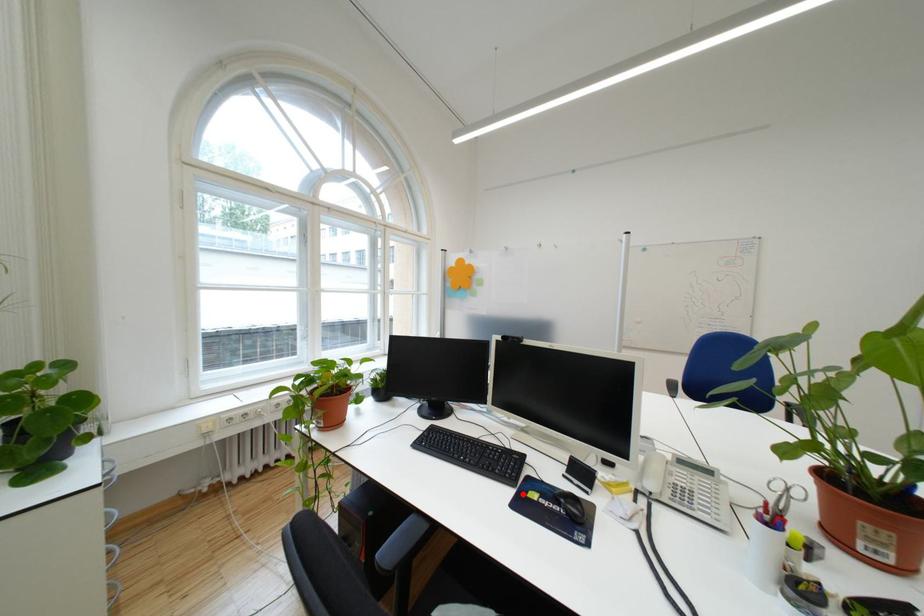
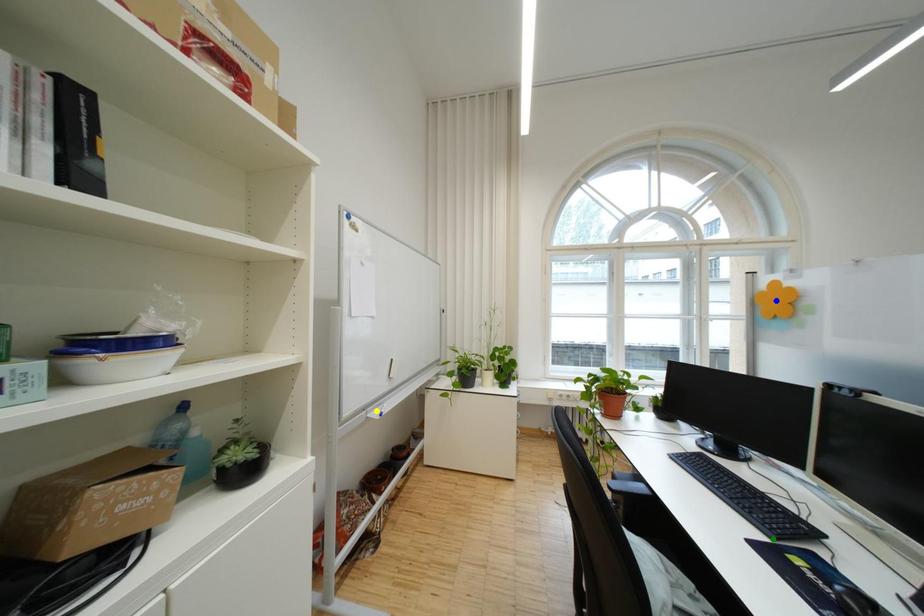
Question: I am providing you with two images of the same scene from different viewpoints. A red point is marked on the first image. You are given multiple points on the second image. Which spot in image 2 lines up with the point in image 1?

Choices:
 (A) green point
 (B) yellow point
 (C) blue point

Answer: (A)